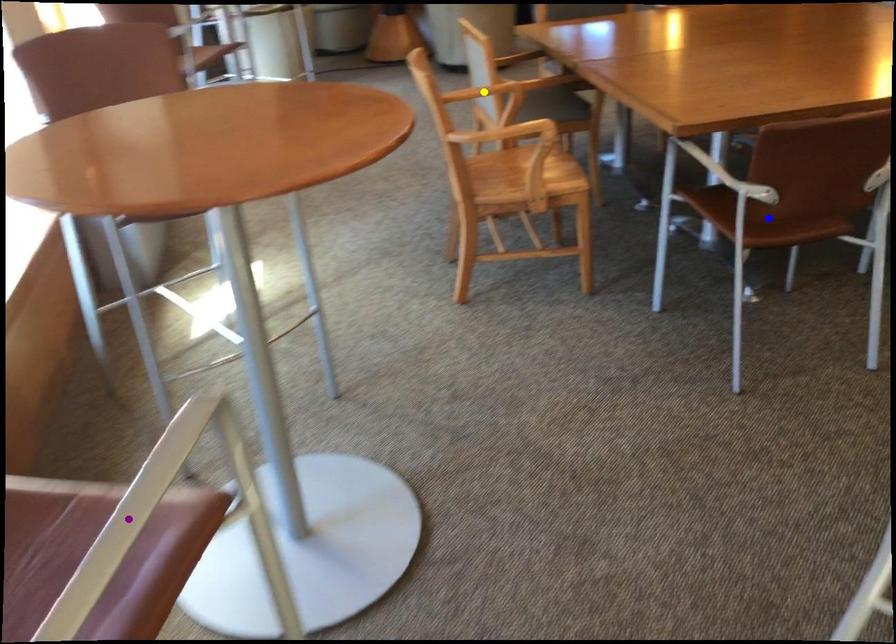
Order these from farthest to nearest:
1. purple point
2. blue point
3. yellow point

1. yellow point
2. blue point
3. purple point